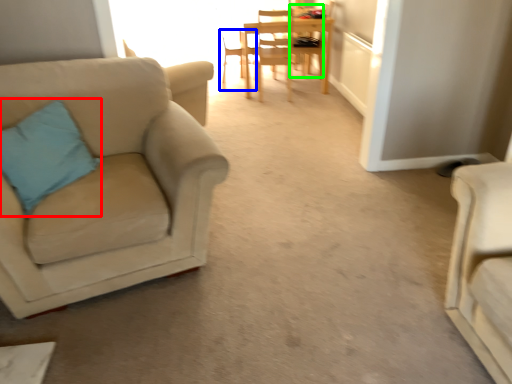
Question: Considering the real-world distances, which object is closest to pillow (highlighted by a red box)? chair (highlighted by a blue box) or chair (highlighted by a green box).

Choices:
 (A) chair
 (B) chair

Answer: (A)